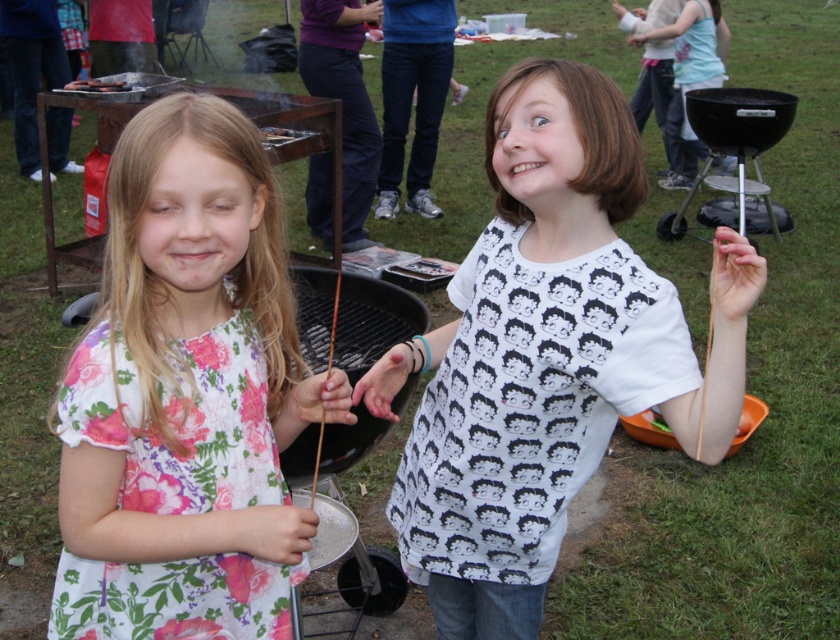
Question: Where is white printed shirt at center located in relation to white printed shirt at upper right in the image?

Choices:
 (A) below
 (B) above

Answer: (A)

Question: Which point is closer to the camera?

Choices:
 (A) white printed shirt at center
 (B) floral fabric dress at center
 (C) white printed shirt at upper right

Answer: (A)

Question: Is white printed shirt at center positioned behind floral fabric dress at center?

Choices:
 (A) no
 (B) yes

Answer: (A)

Question: Does white printed shirt at center have a larger size compared to floral fabric dress at center?

Choices:
 (A) no
 (B) yes

Answer: (B)

Question: Among these objects, which one is nearest to the camera?

Choices:
 (A) white printed shirt at upper right
 (B) white printed shirt at center
 (C) floral fabric dress at center

Answer: (B)

Question: Which is farther from the floral fabric dress at center?

Choices:
 (A) white printed shirt at upper right
 (B) white printed shirt at center

Answer: (A)